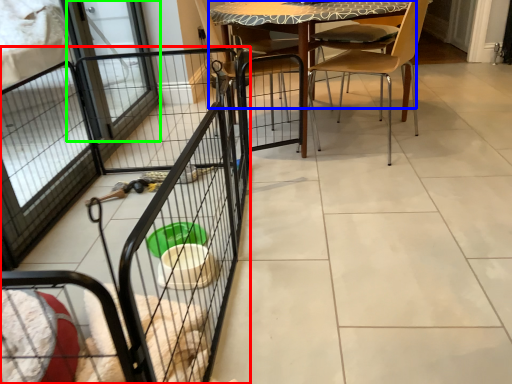
Question: Estimate the real-world distances between objects in this image. Which object is farther from cage (highlighted by a red box), table (highlighted by a blue box) or screen door (highlighted by a green box)?

Choices:
 (A) table
 (B) screen door

Answer: (B)